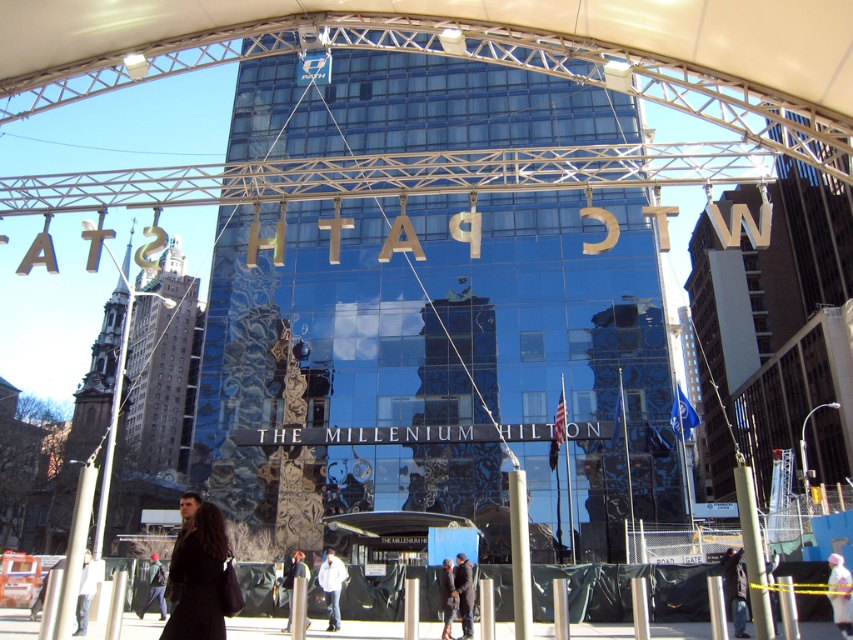
Who is more forward, (90,576) or (445,595)?

Point (445,595) is in front.

Is light brown leather jacket at lower left to the right of dark brown leather jacket at lower center from the viewer's perspective?

In fact, light brown leather jacket at lower left is to the left of dark brown leather jacket at lower center.

Identify the location of light brown leather jacket at lower left. (85, 592).

Is dark gray jacket at center thinner than light brown leather jacket at lower left?

Correct, dark gray jacket at center's width is less than light brown leather jacket at lower left's.

Is dark gray jacket at center to the left of light brown leather jacket at lower left from the viewer's perspective?

In fact, dark gray jacket at center is to the right of light brown leather jacket at lower left.

The image size is (853, 640). Describe the element at coordinates (463, 593) in the screenshot. I see `dark gray jacket at center` at that location.

Identify the location of dark gray jacket at center. pos(463,593).

Who is taller, dark brown leather coat at lower center or dark gray jacket at lower left?

dark gray jacket at lower left

Between dark brown leather coat at lower center and dark gray jacket at lower left, which one appears on the right side from the viewer's perspective?

From the viewer's perspective, dark brown leather coat at lower center appears more on the right side.

At what (x,y) coordinates should I click in order to perform the action: click on dark brown leather coat at lower center. Please return your answer as a coordinate pair (x, y). The image size is (853, 640). Looking at the image, I should click on (198, 577).